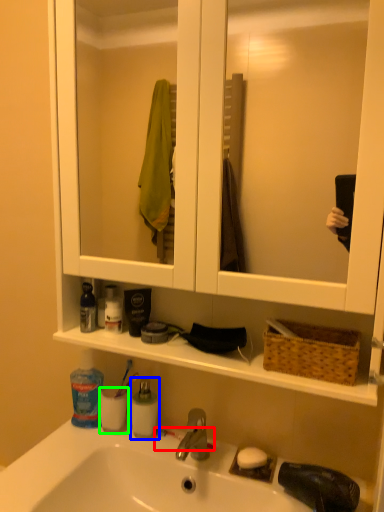
Question: Which is farther away from toothbrush (highlighted by a red box)? mouthwash (highlighted by a blue box) or mouthwash (highlighted by a green box)?

Choices:
 (A) mouthwash
 (B) mouthwash

Answer: (B)